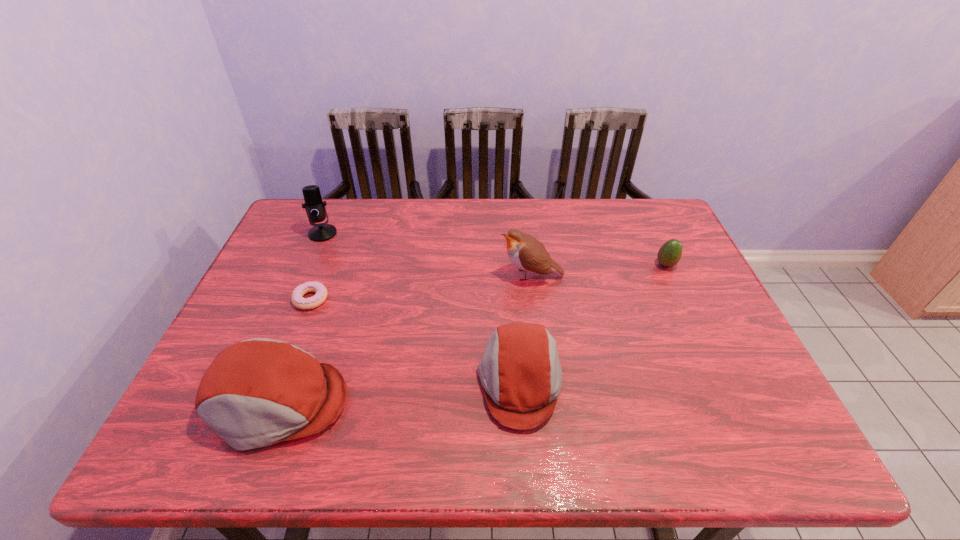
Please show where to add a cap on the right while keeping spacing even. Please provide its 2D coordinates. Your answer should be formatted as a tuple, i.e. [(x, y)], where the tuple contains the x and y coordinates of a point satisfying the conditions above.

[(742, 362)]